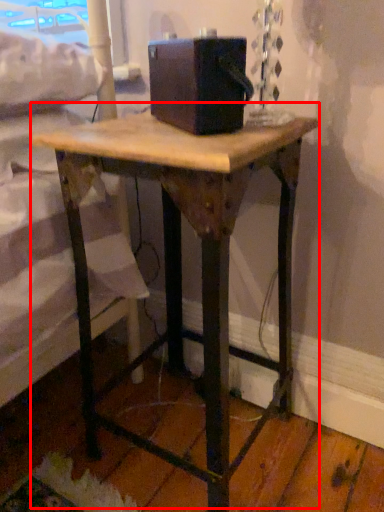
Question: From the image's perspective, considering the relative positions of table (annotated by the red box) and box in the image provided, where is table (annotated by the red box) located with respect to the staircase?

Choices:
 (A) below
 (B) above

Answer: (A)